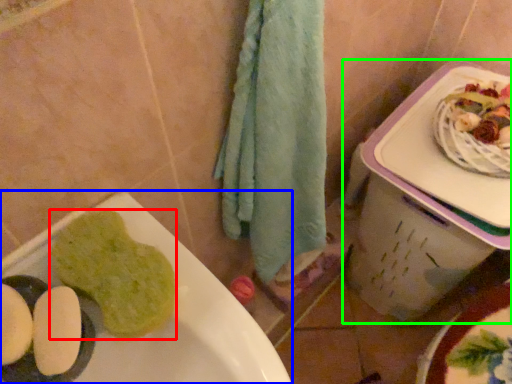
Question: Which object is positioned farthest from food (highlighted by a red box)? Select from sink (highlighted by a blue box) and lunch box (highlighted by a green box).

Choices:
 (A) sink
 (B) lunch box

Answer: (B)